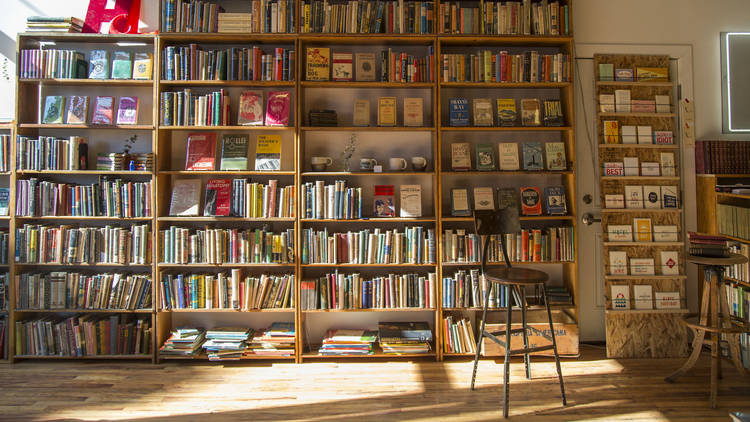
Locate an element on the screen. The height and width of the screenshot is (422, 750). small thin wooden table is located at coordinates (718, 266).